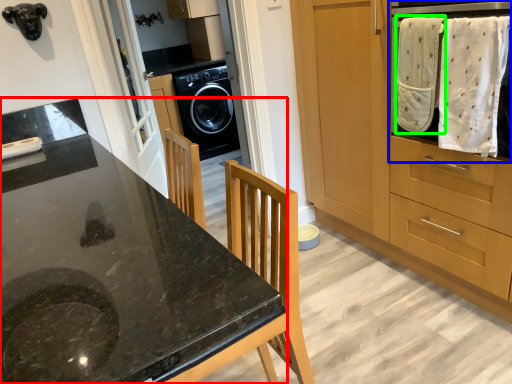
Question: Considering the real-world distances, which object is closest to countertop (highlighted by a red box)? home appliance (highlighted by a blue box) or baby clothe (highlighted by a green box).

Choices:
 (A) home appliance
 (B) baby clothe

Answer: (B)